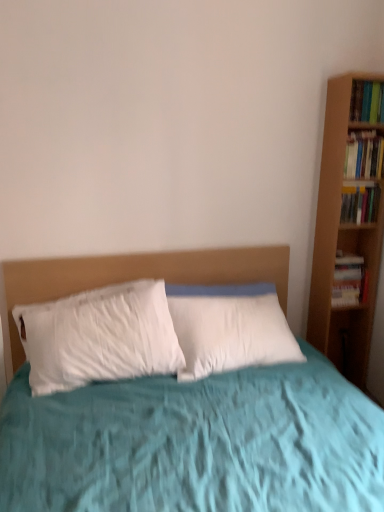
In order to click on free spot above hardcover book at upper right, placed as the fourth book when sorted from bottom to top (from a real-world perspective) in this screenshot , I will do [x=368, y=84].